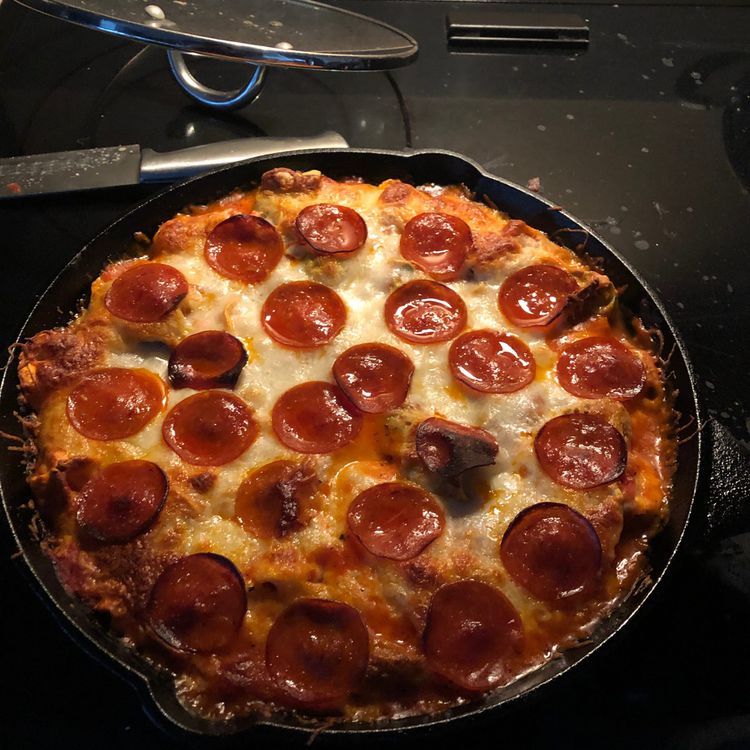
Find any where you grab pan cover in the picture. Your answer should be formatted as a list of tuples, i.e. [(x1, y1), (x2, y2), ...], where each tuple contains the x and y coordinates of a point satisfying the conditions above.

[(208, 96)]